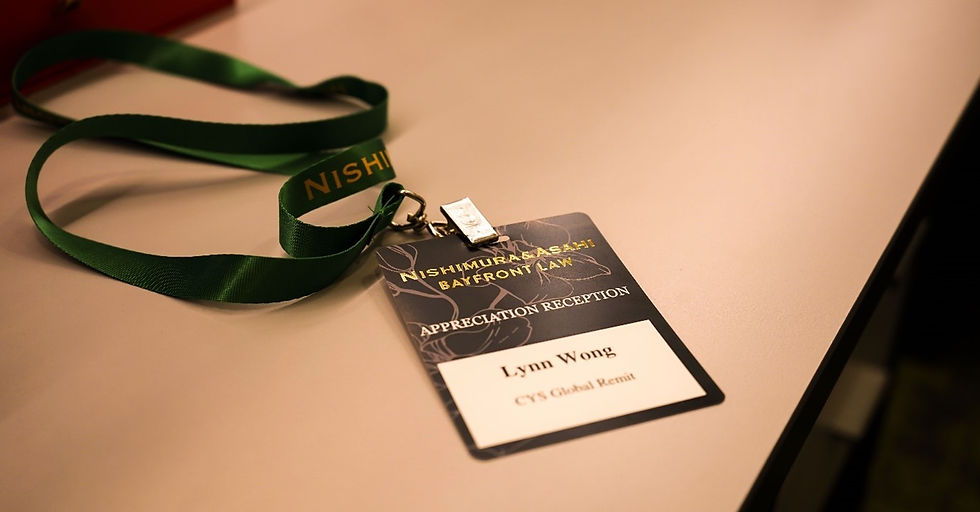
Locate an element on the screen. The image size is (980, 512). table drawers is located at coordinates (864, 407).